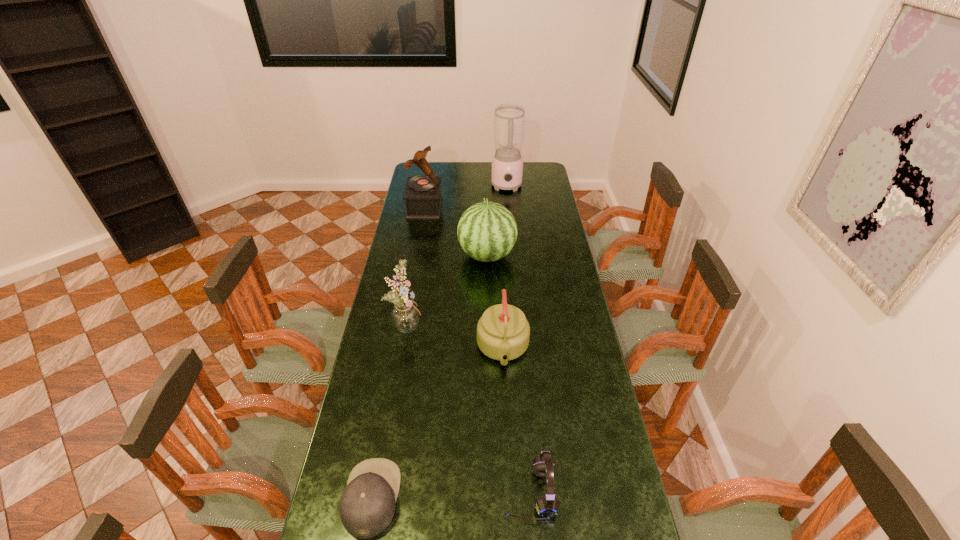
The height and width of the screenshot is (540, 960). I want to click on the tallest object, so click(x=509, y=118).

Identify the location of food processor. (509, 118).

Locate an element on the screen. The height and width of the screenshot is (540, 960). phonograph_record is located at coordinates (422, 195).

What are the coordinates of `bouquet` in the screenshot? It's located at (405, 316).

Where is `the third farthest object`? the third farthest object is located at coordinates (487, 231).

Where is `kettle`? Image resolution: width=960 pixels, height=540 pixels. kettle is located at coordinates (503, 332).

At what (x,y) coordinates should I click in order to perform the action: click on headset. Please return your answer as a coordinate pair (x, y). The height and width of the screenshot is (540, 960). Looking at the image, I should click on (547, 505).

Where is `vacant space located 0.270m on the base of the farthest object near the control knob`? Image resolution: width=960 pixels, height=540 pixels. vacant space located 0.270m on the base of the farthest object near the control knob is located at coordinates (511, 226).

Locate an element on the screen. This screenshot has width=960, height=540. free space located at the horn opening of the second farthest object is located at coordinates (519, 208).

Identify the location of free space located 0.320m on the front-facing side of the bouquet. Image resolution: width=960 pixels, height=540 pixels. (508, 325).